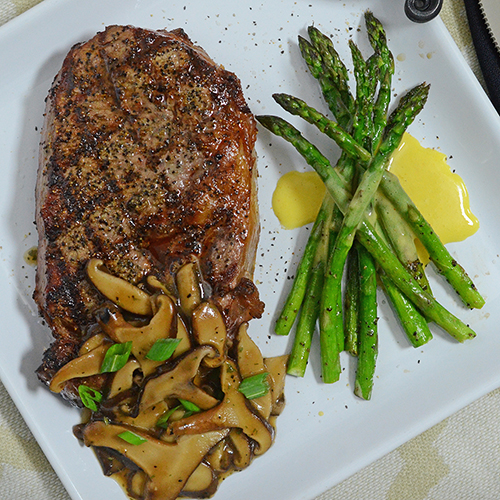
Locate an element on the screen. The width and height of the screenshot is (500, 500). edge of black cloth napkin is located at coordinates (494, 69).